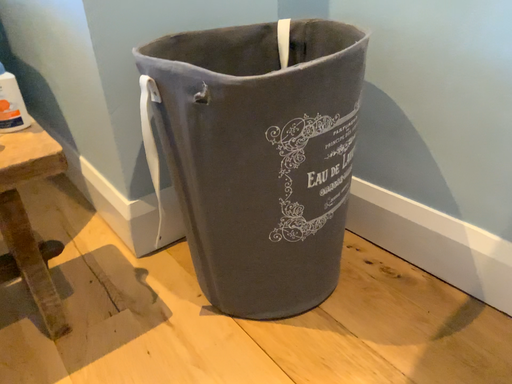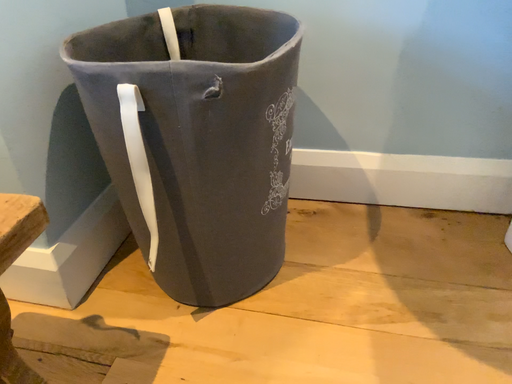
Question: How did the camera likely rotate when shooting the video?

Choices:
 (A) rotated right
 (B) rotated left

Answer: (A)